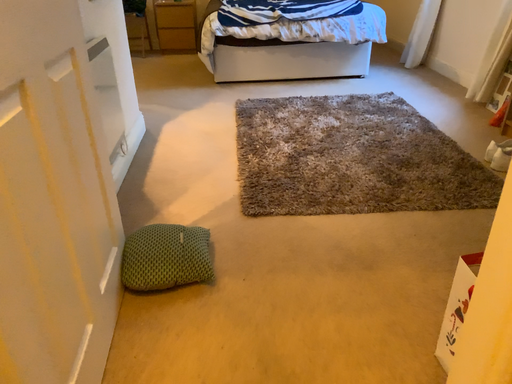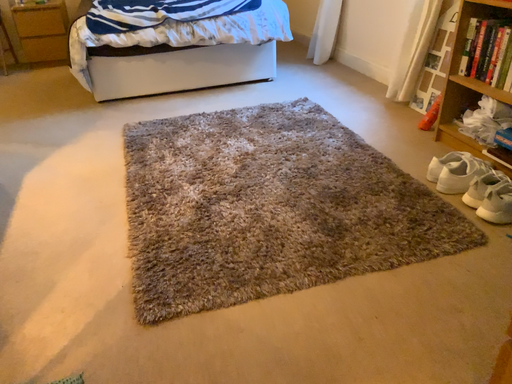
Question: How did the camera likely rotate when shooting the video?

Choices:
 (A) rotated right
 (B) rotated left

Answer: (A)